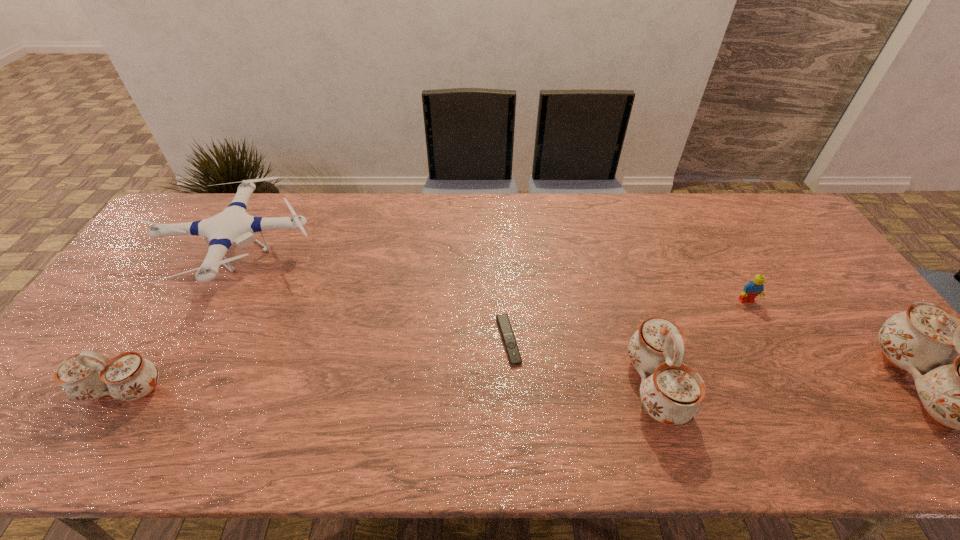
You are a GUI agent. You are given a task and a screenshot of the screen. Output one action in this format:
    pyautogui.click(x=<x>, y=<y>)
    Task: Click on the free space located 0.230m on the right of the drone
    This screenshot has width=960, height=540.
    Given the screenshot: What is the action you would take?
    pyautogui.click(x=399, y=258)

This screenshot has width=960, height=540. Identify the location of free point located on the front of the third object from left to right. pyautogui.click(x=512, y=400).

What are the coordinates of `object present at the far edge` in the screenshot? It's located at (233, 225).

In order to click on chinaware at the left edge in this screenshot , I will do `click(88, 375)`.

Identify the location of drone at the left edge. The image size is (960, 540). (233, 225).

The image size is (960, 540). In order to click on object situated at the far left corner in this screenshot , I will do `click(233, 225)`.

What are the coordinates of `object positioned at the near left corner` in the screenshot? It's located at (88, 375).

Where is `vacant space at the far edge of the desktop`? vacant space at the far edge of the desktop is located at coordinates (306, 230).

Image resolution: width=960 pixels, height=540 pixels. In the image, there is a desktop. Find the location of `vacant space at the near edge`. vacant space at the near edge is located at coordinates (421, 397).

In the image, there is a desktop. Where is `vacant area at the left edge`? Image resolution: width=960 pixels, height=540 pixels. vacant area at the left edge is located at coordinates (116, 323).